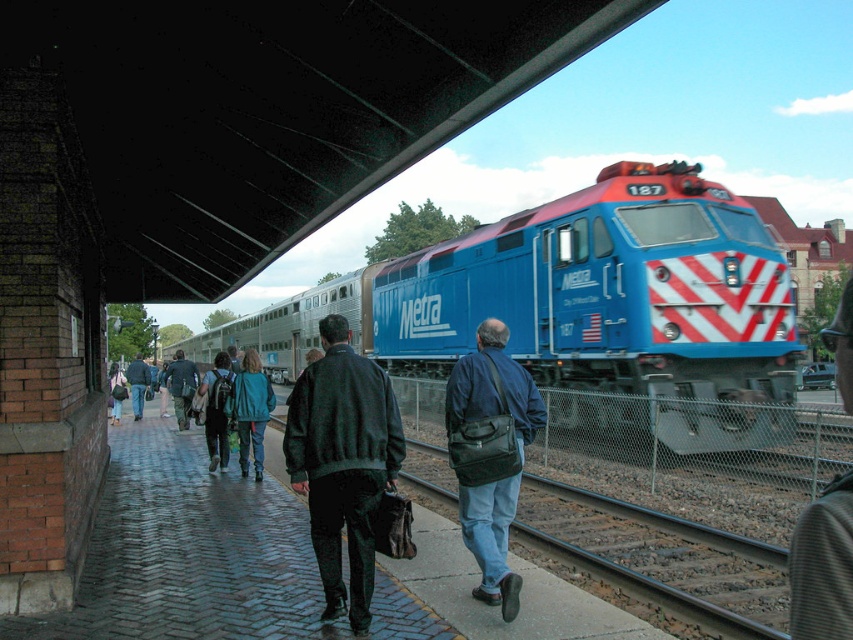
You are standing on the platform at the train station. You see a blue metallic train at center and a dark blue backpack at center. Which object is closer to you?

The blue metallic train at center is closer to you than the dark blue backpack at center.

You are standing at the point labeled point (801, 577) and want to walk to the point labeled point (190, 371). According to the scene, will you be moving towards the train tracks or away from them?

Since point (801, 577) is in front of point (190, 371), moving from point (801, 577) to point (190, 371) would mean you are moving away from the train tracks.

Consider the image. You are a fashion designer observing the crowd at the train station. You notice two jackets worn by people on the platform. The jackets are the dark blue leather jacket at center and the denim jacket at left. Which jacket appears smaller in size?

The dark blue leather jacket at center appears smaller in size compared to the denim jacket at left.